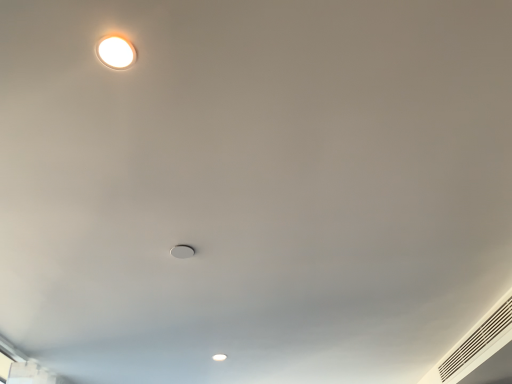
Locate an element on the screen. This screenshot has width=512, height=384. white textured vent at lower right is located at coordinates (480, 351).

What is the approximate width of white textured vent at lower right?

white textured vent at lower right is 1.86 inches wide.

What is the approximate height of white textured vent at lower right?

white textured vent at lower right is 5.57 inches in height.

What do you see at coordinates (480, 351) in the screenshot?
I see `white textured vent at lower right` at bounding box center [480, 351].

Find the location of `matte white lamp at upper left`. matte white lamp at upper left is located at coordinates (116, 52).

Measure the distance between point (106, 64) and camera.

88.80 centimeters.

Image resolution: width=512 pixels, height=384 pixels. What do you see at coordinates (116, 52) in the screenshot?
I see `matte white lamp at upper left` at bounding box center [116, 52].

This screenshot has height=384, width=512. Identify the location of white textured vent at lower right. (480, 351).

Can you confirm if white textured vent at lower right is positioned to the left of matte white lamp at upper left?

No, white textured vent at lower right is not to the left of matte white lamp at upper left.

Is white textured vent at lower right in front of or behind matte white lamp at upper left in the image?

In the image, white textured vent at lower right appears behind matte white lamp at upper left.

Does point (498, 310) lie behind point (130, 47)?

Yes, it is.

From the image's perspective, which one is positioned lower, white textured vent at lower right or matte white lamp at upper left?

From the image's view, white textured vent at lower right is below.

From a real-world perspective, is white textured vent at lower right on top of matte white lamp at upper left?

No, from a real-world perspective, white textured vent at lower right is not over matte white lamp at upper left

Looking at their sizes, would you say white textured vent at lower right is wider or thinner than matte white lamp at upper left?

In the image, white textured vent at lower right appears to be more narrow than matte white lamp at upper left.

From their relative heights in the image, would you say white textured vent at lower right is taller or shorter than matte white lamp at upper left?

Considering their sizes, white textured vent at lower right has more height than matte white lamp at upper left.

In the scene shown: Based on their sizes in the image, would you say white textured vent at lower right is bigger or smaller than matte white lamp at upper left?

Clearly, white textured vent at lower right is larger in size than matte white lamp at upper left.

Is white textured vent at lower right surrounding matte white lamp at upper left?

No, matte white lamp at upper left is not surrounded by white textured vent at lower right.

Are white textured vent at lower right and matte white lamp at upper left located far from each other?

Yes, white textured vent at lower right and matte white lamp at upper left are located far from each other.

Is white textured vent at lower right positioned with its back to matte white lamp at upper left?

No, white textured vent at lower right's orientation is not away from matte white lamp at upper left.

How different are the orientations of white textured vent at lower right and matte white lamp at upper left in degrees?

white textured vent at lower right and matte white lamp at upper left are facing 0.442 degrees away from each other.

How distant is white textured vent at lower right from matte white lamp at upper left?

A distance of 2.15 meters exists between white textured vent at lower right and matte white lamp at upper left.

The width and height of the screenshot is (512, 384). I want to click on air conditioning below the matte white lamp at upper left (from the image's perspective), so click(x=480, y=351).

Is matte white lamp at upper left at the right side of white textured vent at lower right?

Incorrect, matte white lamp at upper left is not on the right side of white textured vent at lower right.

Which object is further away from the camera, matte white lamp at upper left or white textured vent at lower right?

white textured vent at lower right is further away from the camera.

Which is behind, point (130, 48) or point (475, 367)?

The point (475, 367) is behind.

Consider the image. From the image's perspective, who appears lower, matte white lamp at upper left or white textured vent at lower right?

white textured vent at lower right, from the image's perspective.

From a real-world perspective, is matte white lamp at upper left on top of white textured vent at lower right?

Yes, from a real-world perspective, matte white lamp at upper left is on top of white textured vent at lower right.

Between matte white lamp at upper left and white textured vent at lower right, which one has smaller width?

white textured vent at lower right is thinner.

Considering the sizes of matte white lamp at upper left and white textured vent at lower right in the image, is matte white lamp at upper left taller or shorter than white textured vent at lower right?

Clearly, matte white lamp at upper left is shorter compared to white textured vent at lower right.

In terms of size, does matte white lamp at upper left appear bigger or smaller than white textured vent at lower right?

In the image, matte white lamp at upper left appears to be smaller than white textured vent at lower right.

Would you say white textured vent at lower right is part of matte white lamp at upper left's contents?

No, white textured vent at lower right is not a part of matte white lamp at upper left.

Based on the photo, is matte white lamp at upper left beside white textured vent at lower right?

No, matte white lamp at upper left is not making contact with white textured vent at lower right.

Is matte white lamp at upper left turned away from white textured vent at lower right?

No, matte white lamp at upper left's orientation is not away from white textured vent at lower right.

Where is `air conditioning behind the matte white lamp at upper left`? The image size is (512, 384). air conditioning behind the matte white lamp at upper left is located at coordinates (480, 351).

The width and height of the screenshot is (512, 384). I want to click on lamp above the white textured vent at lower right (from the image's perspective), so click(x=116, y=52).

At what (x,y) coordinates should I click in order to perform the action: click on lamp above the white textured vent at lower right (from a real-world perspective). Please return your answer as a coordinate pair (x, y). Looking at the image, I should click on (116, 52).